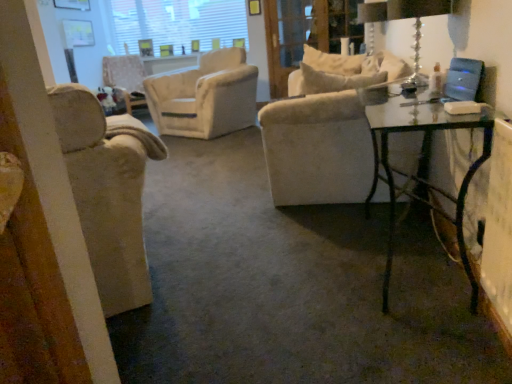
Question: Is velvet beige armchair at center, which ranks as the 2th chair in bottom-to-top order, turned away from clear glass table lamp at upper right?

Choices:
 (A) yes
 (B) no

Answer: (B)

Question: From the image's perspective, is velvet beige armchair at center, which ranks as the 2th chair in bottom-to-top order, on clear glass table lamp at upper right?

Choices:
 (A) no
 (B) yes

Answer: (B)

Question: Is velvet beige armchair at center, which ranks as the first chair in left-to-right order, wider than clear glass table lamp at upper right?

Choices:
 (A) yes
 (B) no

Answer: (A)

Question: Is velvet beige armchair at center, which ranks as the 2th chair in bottom-to-top order, to the left of clear glass table lamp at upper right from the viewer's perspective?

Choices:
 (A) yes
 (B) no

Answer: (A)

Question: Is velvet beige armchair at center, positioned as the 2th chair in front-to-back order, located outside clear glass table lamp at upper right?

Choices:
 (A) no
 (B) yes

Answer: (B)

Question: Is the depth of velvet beige armchair at center, which ranks as the first chair in back-to-front order, less than that of clear glass table lamp at upper right?

Choices:
 (A) yes
 (B) no

Answer: (B)

Question: Is velvet beige armchair at center, which ranks as the first chair in left-to-right order, not inside white textured window screen at upper center?

Choices:
 (A) no
 (B) yes

Answer: (B)

Question: Is velvet beige armchair at center, which ranks as the 2th chair in bottom-to-top order, bigger than white textured window screen at upper center?

Choices:
 (A) yes
 (B) no

Answer: (A)

Question: Would you say velvet beige armchair at center, marked as the first chair in a top-to-bottom arrangement, contains white textured window screen at upper center?

Choices:
 (A) no
 (B) yes

Answer: (A)

Question: Does velvet beige armchair at center, marked as the first chair in a top-to-bottom arrangement, have a lesser width compared to white textured window screen at upper center?

Choices:
 (A) yes
 (B) no

Answer: (B)

Question: Can you confirm if velvet beige armchair at center, which is the 2th chair in right-to-left order, is positioned to the left of white textured window screen at upper center?

Choices:
 (A) no
 (B) yes

Answer: (B)

Question: Considering the relative positions of velvet beige armchair at center, which ranks as the first chair in back-to-front order, and white textured window screen at upper center in the image provided, is velvet beige armchair at center, which ranks as the first chair in back-to-front order, to the right of white textured window screen at upper center from the viewer's perspective?

Choices:
 (A) no
 (B) yes

Answer: (A)

Question: From the image's perspective, is clear glass screen door at upper center over velvet beige armchair at center, which ranks as the first chair in back-to-front order?

Choices:
 (A) yes
 (B) no

Answer: (A)